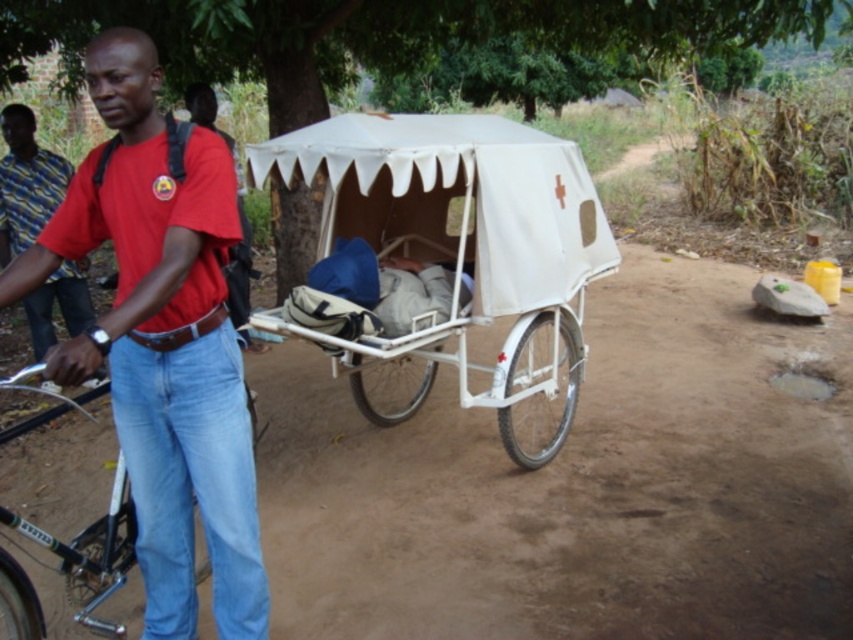
Based on the photo, is white matte wagon at center wider than black matte bicycle at left?

Yes, white matte wagon at center is wider than black matte bicycle at left.

Is white matte wagon at center positioned before black matte bicycle at left?

That is False.

Between point (277, 172) and point (128, 499), which one is positioned in front?

Point (128, 499) is more forward.

The height and width of the screenshot is (640, 853). Find the location of `white matte wagon at center`. white matte wagon at center is located at coordinates (456, 256).

Who is taller, black matte bicycle at left or red cotton shirt at left?

black matte bicycle at left

Is point (94, 554) in front of point (70, 273)?

Yes, it is.

Where is `black matte bicycle at left`? This screenshot has height=640, width=853. black matte bicycle at left is located at coordinates (91, 554).

Does brown dirt track at center lie in front of red cotton shirt at left?

That is True.

Who is positioned more to the right, brown dirt track at center or red cotton shirt at left?

brown dirt track at center is more to the right.

Which is behind, point (311, 432) or point (41, 326)?

Point (41, 326)

Find the location of `brown dirt track at center`. brown dirt track at center is located at coordinates (577, 484).